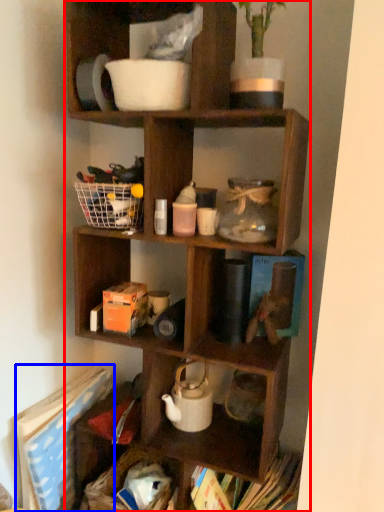
Question: Which of the following is the farthest to the observer, shelf (highlighted by a red box) or book (highlighted by a blue box)?

Choices:
 (A) shelf
 (B) book

Answer: (B)